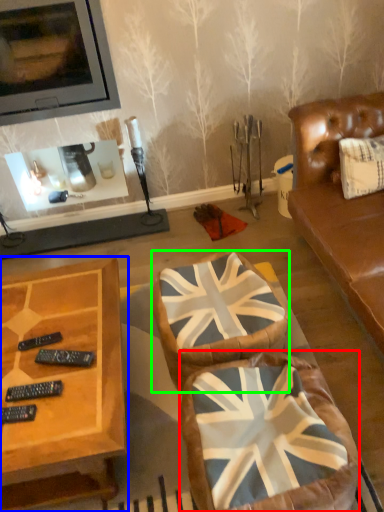
Question: Estimate the real-world distances between objects in this image. Which object is farther from swivel chair (highlighted by a red box), coffee table (highlighted by a blue box) or swivel chair (highlighted by a green box)?

Choices:
 (A) coffee table
 (B) swivel chair

Answer: (A)